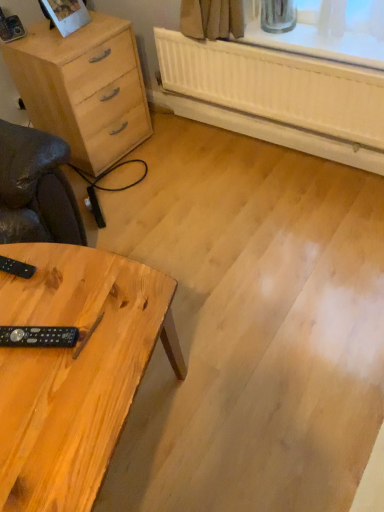
Question: Is natural wood chest of drawers at left wider than natural wood table at lower left?

Choices:
 (A) no
 (B) yes

Answer: (A)

Question: Is natural wood chest of drawers at left to the right of natural wood table at lower left from the viewer's perspective?

Choices:
 (A) yes
 (B) no

Answer: (B)

Question: Considering the relative sizes of natural wood chest of drawers at left and natural wood table at lower left in the image provided, is natural wood chest of drawers at left smaller than natural wood table at lower left?

Choices:
 (A) no
 (B) yes

Answer: (B)

Question: Is natural wood chest of drawers at left to the left of natural wood table at lower left from the viewer's perspective?

Choices:
 (A) yes
 (B) no

Answer: (A)

Question: Is natural wood chest of drawers at left further to the viewer compared to natural wood table at lower left?

Choices:
 (A) yes
 (B) no

Answer: (A)

Question: In terms of size, does natural wood chest of drawers at left appear bigger or smaller than black plastic remote at lower left, arranged as the 2th control when viewed from the top?

Choices:
 (A) big
 (B) small

Answer: (A)

Question: Is natural wood chest of drawers at left inside or outside of black plastic remote at lower left, arranged as the 2th control when viewed from the top?

Choices:
 (A) outside
 (B) inside

Answer: (A)

Question: From the image's perspective, is natural wood chest of drawers at left above or below black plastic remote at lower left, arranged as the 2th control when viewed from the top?

Choices:
 (A) above
 (B) below

Answer: (A)

Question: From a real-world perspective, is natural wood chest of drawers at left positioned above or below black plastic remote at lower left, acting as the 1th control starting from the bottom?

Choices:
 (A) above
 (B) below

Answer: (B)

Question: Visually, is natural wood table at lower left positioned to the left or to the right of black plastic remote at lower left, acting as the 1th control starting from the bottom?

Choices:
 (A) right
 (B) left

Answer: (A)

Question: From a real-world perspective, is natural wood table at lower left positioned above or below black plastic remote at lower left, acting as the 1th control starting from the bottom?

Choices:
 (A) above
 (B) below

Answer: (B)

Question: Is point (29, 477) positioned closer to the camera than point (31, 333)?

Choices:
 (A) farther
 (B) closer

Answer: (B)

Question: Looking at the image, does natural wood table at lower left seem bigger or smaller compared to black plastic remote at lower left, acting as the 1th control starting from the bottom?

Choices:
 (A) big
 (B) small

Answer: (A)

Question: From the image's perspective, is natural wood chest of drawers at left positioned above or below natural wood table at lower left?

Choices:
 (A) above
 (B) below

Answer: (A)

Question: In terms of height, does natural wood chest of drawers at left look taller or shorter compared to natural wood table at lower left?

Choices:
 (A) short
 (B) tall

Answer: (B)